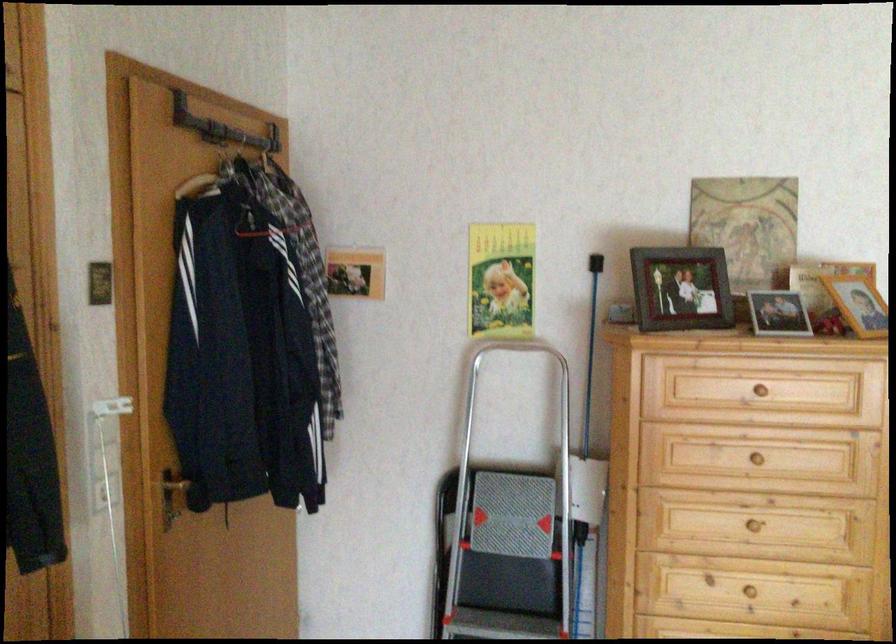
I want to click on clothes hanger, so click(x=212, y=144).